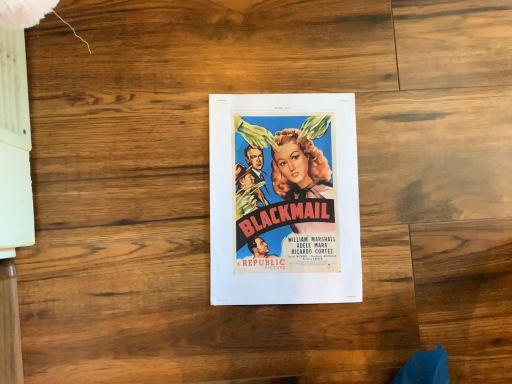
What do you see at coordinates (284, 199) in the screenshot?
I see `matte paper poster at center` at bounding box center [284, 199].

Looking at this image, measure the distance between matte paper poster at center and camera.

matte paper poster at center and camera are 22.83 inches apart.

In order to click on matte paper poster at center in this screenshot , I will do `click(284, 199)`.

You are a GUI agent. You are given a task and a screenshot of the screen. Output one action in this format:
    pyautogui.click(x=<x>, y=<y>)
    Task: Click on the matte paper poster at center
    This screenshot has height=384, width=512.
    Given the screenshot: What is the action you would take?
    pyautogui.click(x=284, y=199)